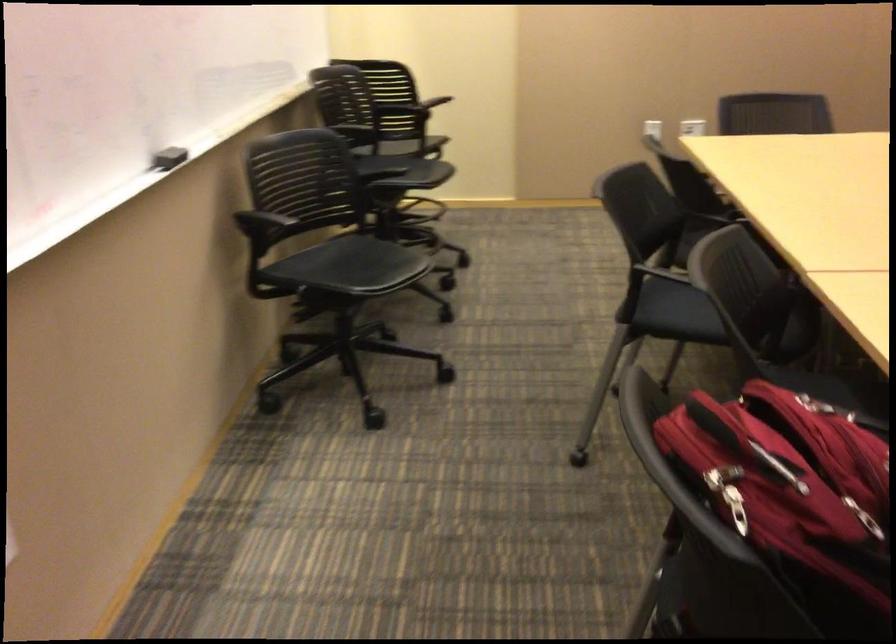
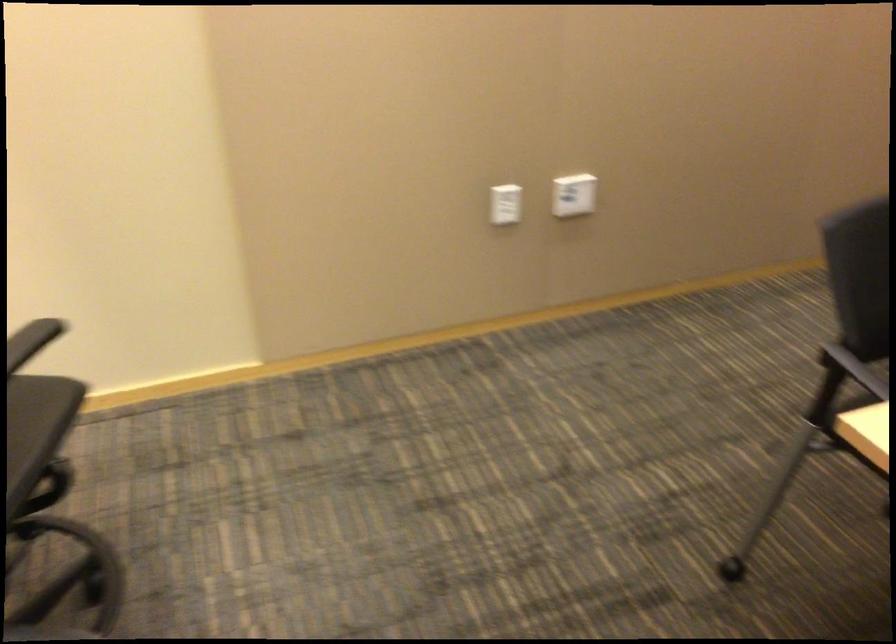
Question: Which direction would the cameraman need to move to produce the second image? Reply with the corresponding letter.

Choices:
 (A) Left
 (B) Right
 (C) Forward
 (D) Backward

Answer: (C)